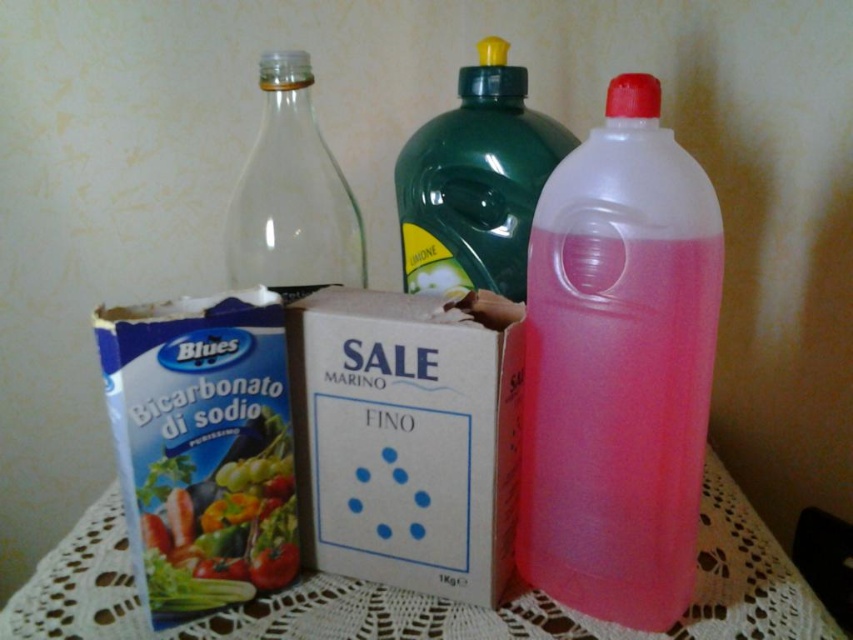
You are arranging items on a table and see the white lace tablecloth at lower center and the green matte vegetable at left. Which item is positioned lower on the table?

The white lace tablecloth at lower center is positioned lower than the green matte vegetable at left.

You are arranging ingredients for a recipe and need to place the green matte vegetable at left closer to the white lace tablecloth at lower center. Which direction should you move the vegetable?

Move the green matte vegetable at left to the right to place it closer to the white lace tablecloth at lower center.